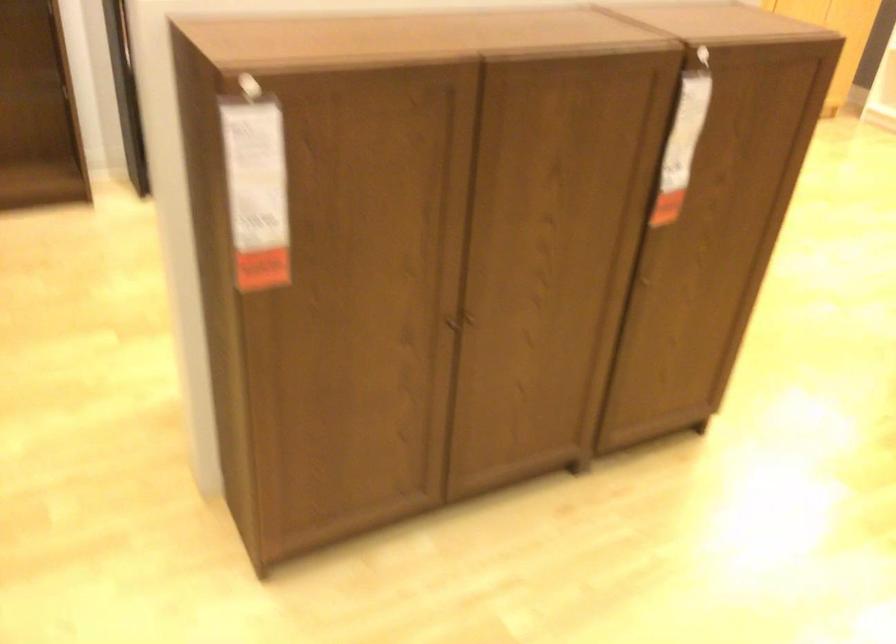
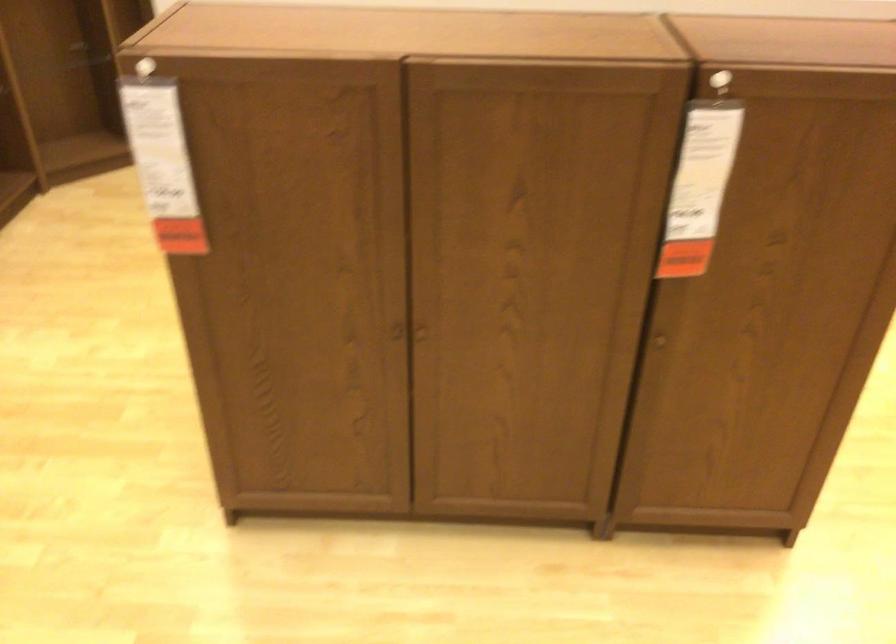
Locate, in the second image, the point that corresponds to [644,279] in the first image.

(659, 341)